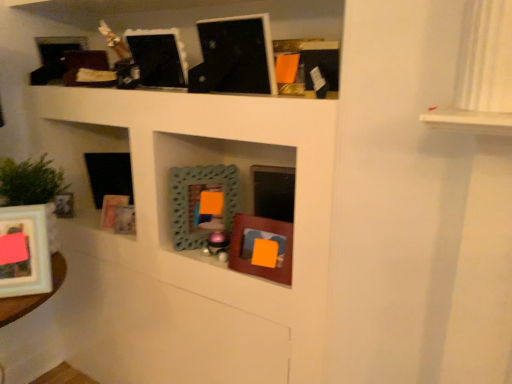
Question: From a real-world perspective, is matte white picture frame at lower left, arranged as the 2th picture frame when viewed from the left, over wooden picture frame at lower left, placed as the 5th picture frame when sorted from right to left?

Choices:
 (A) no
 (B) yes

Answer: (B)

Question: Considering the relative positions of matte white picture frame at lower left, arranged as the 2th picture frame when viewed from the left, and wooden picture frame at lower left, placed as the 5th picture frame when sorted from right to left, in the image provided, is matte white picture frame at lower left, arranged as the 2th picture frame when viewed from the left, to the right of wooden picture frame at lower left, placed as the 5th picture frame when sorted from right to left, from the viewer's perspective?

Choices:
 (A) no
 (B) yes

Answer: (A)

Question: Is the position of matte white picture frame at lower left, arranged as the 2th picture frame when viewed from the left, less distant than that of wooden picture frame at lower left, placed as the 5th picture frame when sorted from right to left?

Choices:
 (A) no
 (B) yes

Answer: (B)

Question: Does matte white picture frame at lower left, arranged as the 2th picture frame when viewed from the left, lie behind wooden picture frame at lower left, arranged as the 5th picture frame when viewed from the left?

Choices:
 (A) no
 (B) yes

Answer: (A)

Question: From the image's perspective, is matte white picture frame at lower left, arranged as the 2th picture frame when viewed from the left, on wooden picture frame at lower left, placed as the 5th picture frame when sorted from right to left?

Choices:
 (A) yes
 (B) no

Answer: (B)

Question: Is point (228, 198) closer or farther from the camera than point (289, 238)?

Choices:
 (A) farther
 (B) closer

Answer: (A)

Question: From a real-world perspective, relative to wooden picture frame at center, which appears as the first picture frame when viewed from the right, is teal textured mirror at center, acting as the 7th picture frame starting from the left, vertically above or below?

Choices:
 (A) below
 (B) above

Answer: (B)

Question: Is teal textured mirror at center, acting as the 7th picture frame starting from the left, taller or shorter than wooden picture frame at center, which appears as the first picture frame when viewed from the right?

Choices:
 (A) tall
 (B) short

Answer: (A)

Question: From the image's perspective, relative to wooden picture frame at center, which is counted as the ninth picture frame, starting from the left, is teal textured mirror at center, which is the 3th picture frame from right to left, above or below?

Choices:
 (A) below
 (B) above

Answer: (B)

Question: Relative to teal textured mirror at center, which is the 3th picture frame from right to left, is matte white picture frame at lower left, arranged as the 2th picture frame when viewed from the left, in front or behind?

Choices:
 (A) front
 (B) behind

Answer: (A)

Question: Looking at the image, does matte white picture frame at lower left, which appears as the 8th picture frame when viewed from the right, seem bigger or smaller compared to teal textured mirror at center, which is the 3th picture frame from right to left?

Choices:
 (A) big
 (B) small

Answer: (A)

Question: Considering the positions of matte white picture frame at lower left, which appears as the 8th picture frame when viewed from the right, and teal textured mirror at center, acting as the 7th picture frame starting from the left, in the image, is matte white picture frame at lower left, which appears as the 8th picture frame when viewed from the right, taller or shorter than teal textured mirror at center, acting as the 7th picture frame starting from the left,?

Choices:
 (A) short
 (B) tall

Answer: (B)

Question: From the image's perspective, is matte white picture frame at lower left, arranged as the 2th picture frame when viewed from the left, positioned above or below teal textured mirror at center, which is the 3th picture frame from right to left?

Choices:
 (A) below
 (B) above

Answer: (A)

Question: From their relative heights in the image, would you say matte white picture frame at lower left, arranged as the 2th picture frame when viewed from the left, is taller or shorter than matte black picture frame at left, acting as the 9th picture frame starting from the right?

Choices:
 (A) short
 (B) tall

Answer: (B)

Question: Relative to matte black picture frame at left, which is the 1th picture frame from left to right, is matte white picture frame at lower left, arranged as the 2th picture frame when viewed from the left, in front or behind?

Choices:
 (A) behind
 (B) front

Answer: (B)